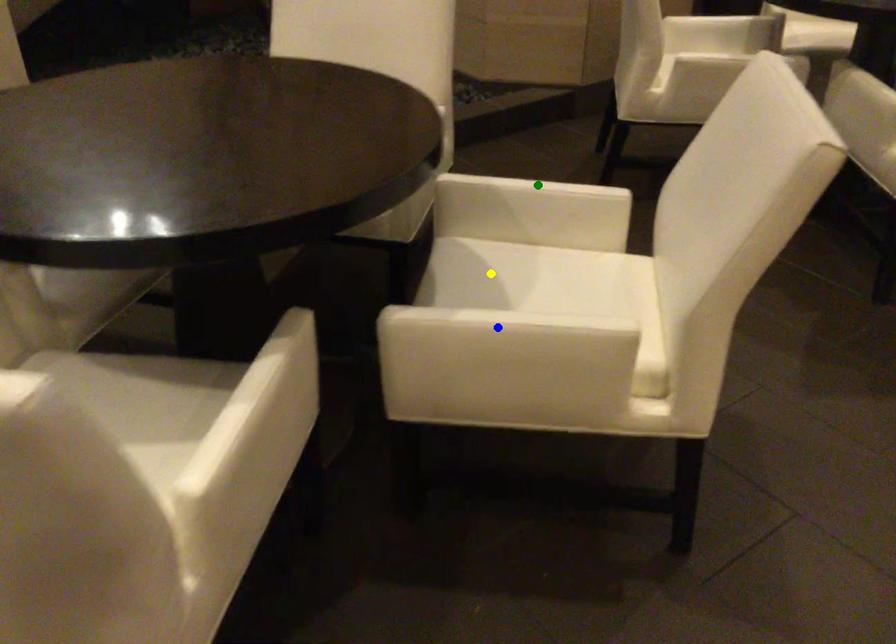
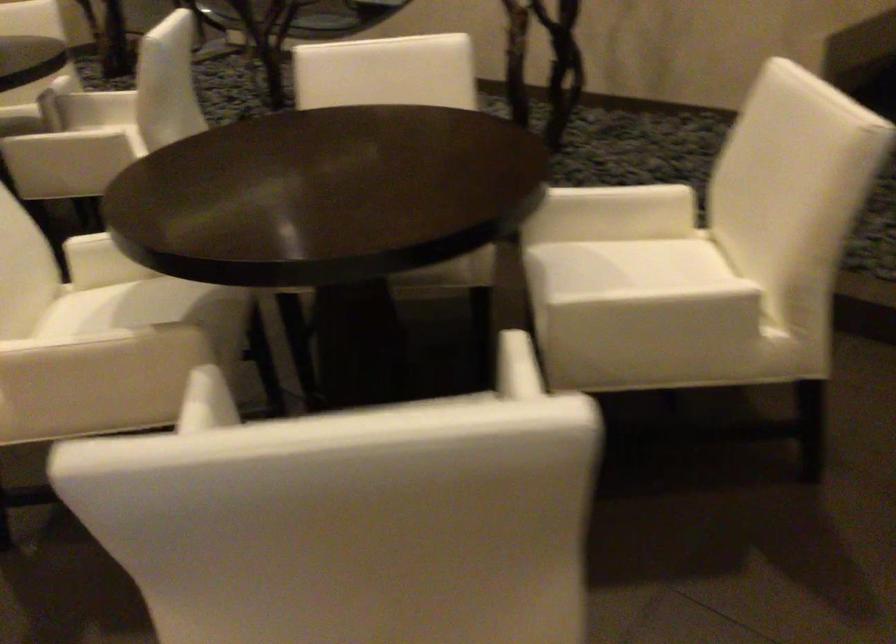
I am providing you with two images of the same scene from different viewpoints. Three points are marked in image1. Which point corresponds to a part or object that is occluded in image2?In image1, three points are marked. Which of them correspond to a part or object that is occluded in image2?Among the three points shown in image1, which one corresponds to a part or object that is no longer visible due to occlusion in image2?

Invisible in image2: green point, yellow point, blue point.